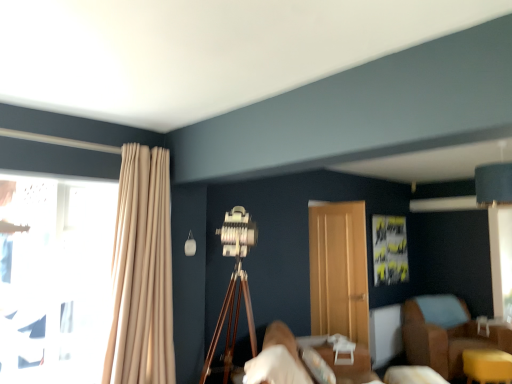
Question: In terms of size, does beige fabric curtain at left appear bigger or smaller than transparent glass window at left?

Choices:
 (A) small
 (B) big

Answer: (B)

Question: Considering the positions of point coord(151,251) and point coord(57,233), is point coord(151,251) closer or farther from the camera than point coord(57,233)?

Choices:
 (A) closer
 (B) farther

Answer: (B)

Question: Which is farther from the white fabric bed at lower center?

Choices:
 (A) wooden tripod at center
 (B) transparent glass window at left
 (C) wooden door at center
 (D) beige fabric curtain at left
 (E) yellow matte table at lower right

Answer: (B)

Question: Which of these objects is positioned farthest from the wooden door at center?

Choices:
 (A) transparent glass window at left
 (B) beige fabric curtain at left
 (C) white fabric bed at lower center
 (D) wooden tripod at center
 (E) yellow matte table at lower right

Answer: (A)